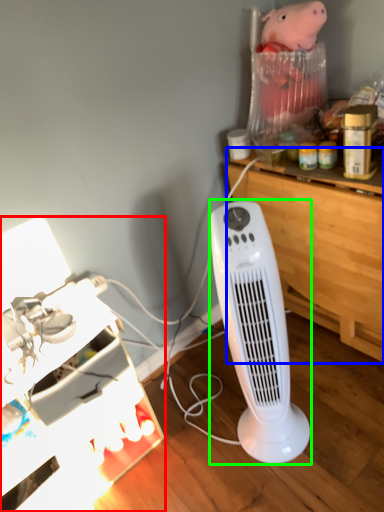
Question: Which object is the farthest from furniture (highlighted by a red box)? Choose among these: computer desk (highlighted by a blue box) or home appliance (highlighted by a green box).

Choices:
 (A) computer desk
 (B) home appliance

Answer: (A)